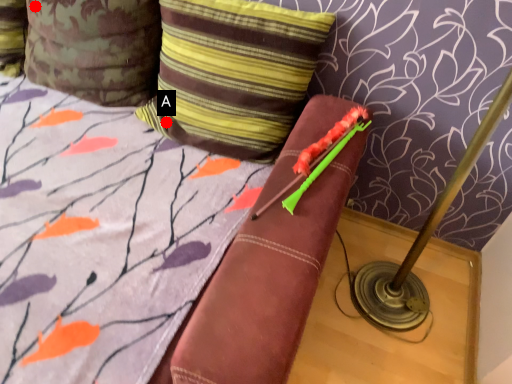
Question: Two points are circled on the image, labeled by A and B beside each circle. Which of the following is the farthest from the observer?

Choices:
 (A) A is further
 (B) B is further

Answer: (B)